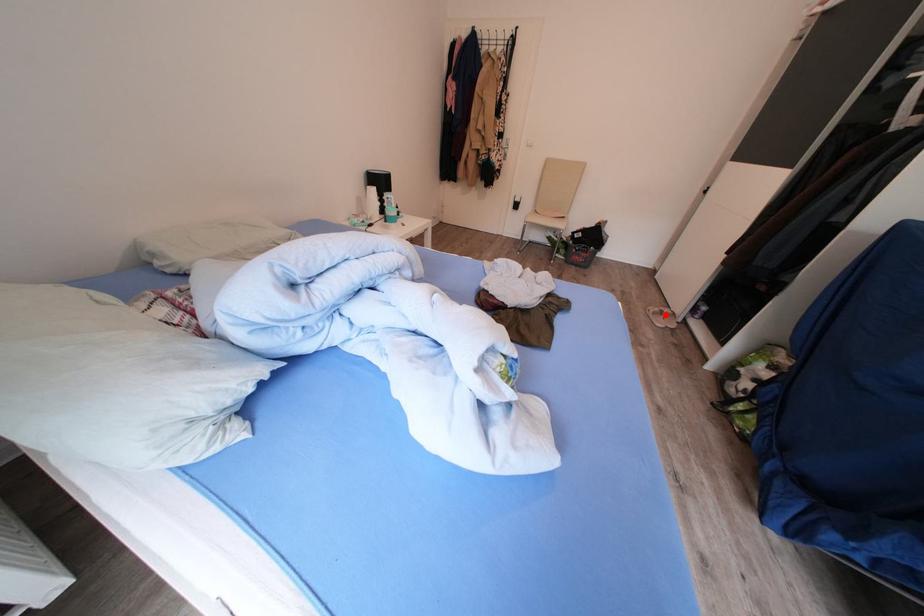
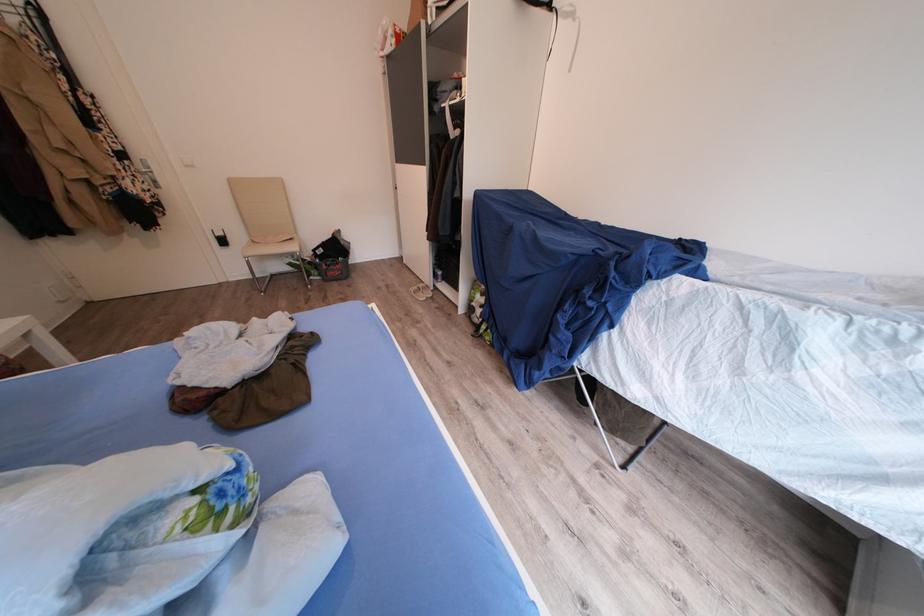
In the second image, find the point that corresponds to the highlighted location in the first image.

(424, 293)